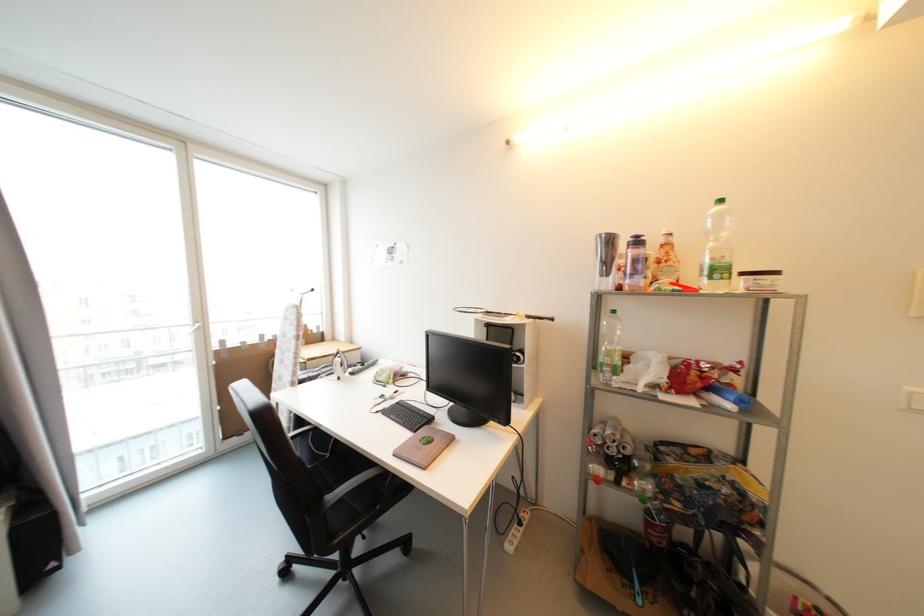
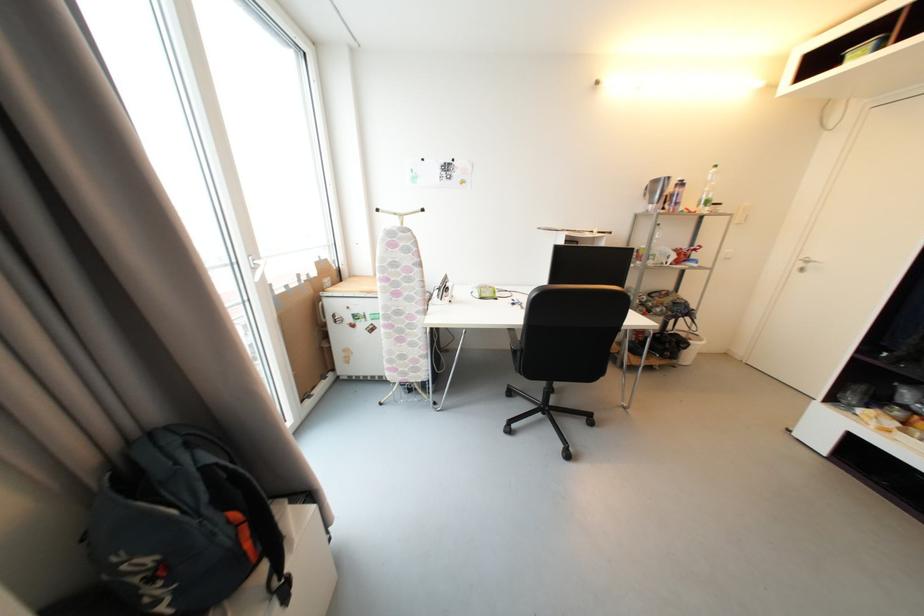
In the second image, find the point that corresponds to [711,281] in the first image.

(707, 208)